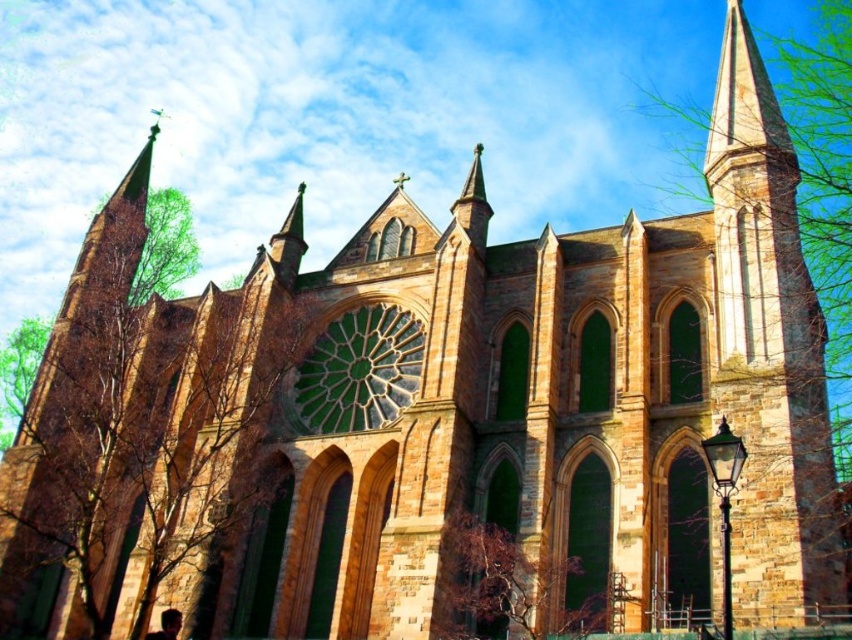
Question: Which point appears farthest from the camera in this image?

Choices:
 (A) [511, 566]
 (B) [222, 522]

Answer: (B)

Question: Does green leafy tree at left come in front of brown textured tree at lower center?

Choices:
 (A) yes
 (B) no

Answer: (B)

Question: Observing the image, what is the correct spatial positioning of green leafy tree at left in reference to brown textured tree at lower center?

Choices:
 (A) below
 (B) above

Answer: (B)

Question: Is green leafy tree at left positioned in front of brown textured tree at lower center?

Choices:
 (A) no
 (B) yes

Answer: (A)